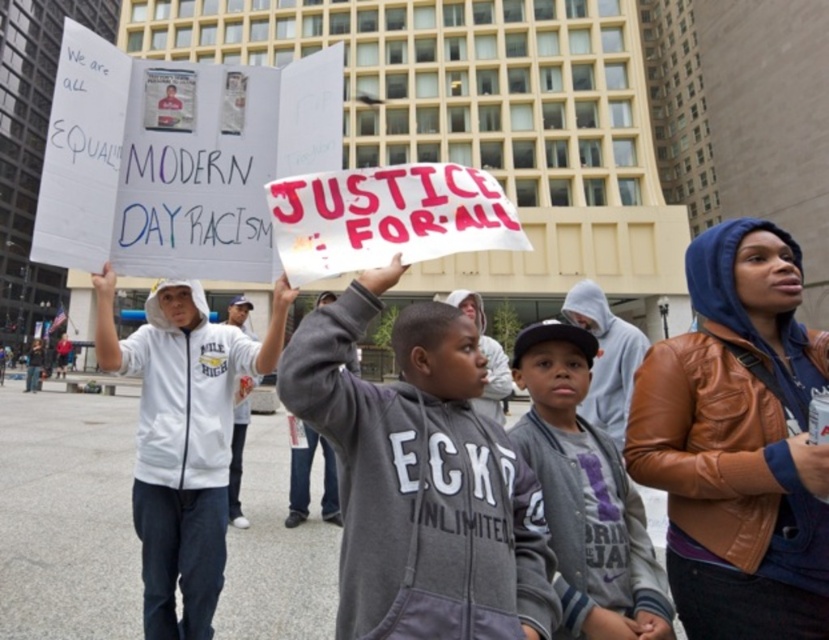
You are a photographer trying to capture a clear shot of both the white hoodie at center and the gray fleece jacket at center. Based on their positions, which one is more likely to block the other from view?

The white hoodie at center is wider than the gray fleece jacket at center, so it might block the gray fleece jacket at center from view.

What are the coordinates of the brown leather jacket at center?

The coordinates of the brown leather jacket at center are at point (x=738, y=442).

From the picture: You are a photographer trying to capture a group photo of the protesters. You need to ensure that both the white hoodie at center and the gray fleece jacket at center are in the frame. Given that your camera has a maximum focus range of 1.5 meters, will you be able to capture both subjects clearly in the same shot?

The white hoodie at center and gray fleece jacket at center are 1.80 meters apart from each other. Since the camera can only focus within 1.5 meters, the distance between them exceeds the focus range. Therefore, you cannot capture both subjects clearly in the same shot.